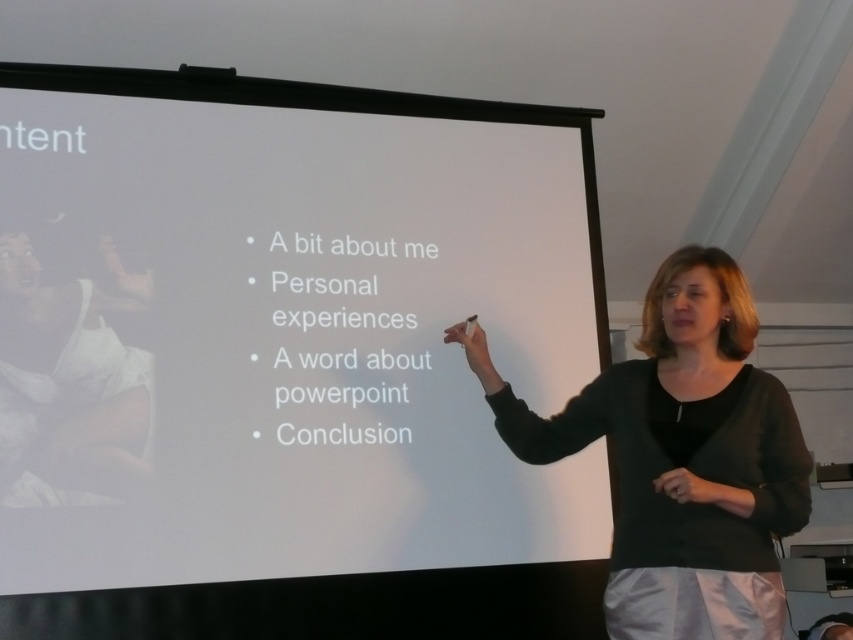
You are an event organizer setting up a presentation room. You have two items to place on the stage area in front of the audience. The items are the white matte projection screen at center and the black fabric at center. According to the image, which item should you place higher up on the stage to ensure visibility for the audience?

The white matte projection screen at center has a greater height compared to the black fabric at center, so you should place the white matte projection screen at center higher up on the stage to ensure visibility for the audience.

Based on the photo, you are an event organizer setting up for a presentation. You need to decide which item, the white matte projection screen at center or the black fabric at center, should be placed in front to ensure the presentation content is clearly visible. Which one should you choose and why?

You should place the white matte projection screen at center in front because it has a larger size compared to the black fabric at center, making it easier to project and view the presentation content clearly.